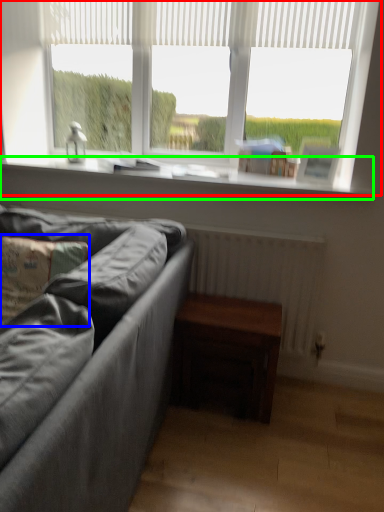
Question: Which object is the farthest from window (highlighted by a red box)? Choose among these: pillow (highlighted by a blue box) or window sill (highlighted by a green box).

Choices:
 (A) pillow
 (B) window sill

Answer: (A)